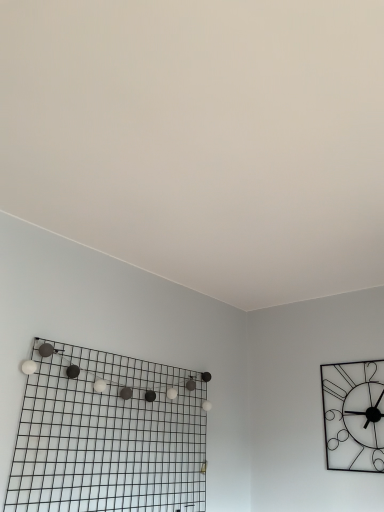
Identify the location of white matte wall clock at upper right. Image resolution: width=384 pixels, height=512 pixels. (354, 415).

This screenshot has width=384, height=512. What do you see at coordinates (354, 415) in the screenshot? I see `white matte wall clock at upper right` at bounding box center [354, 415].

You are a GUI agent. You are given a task and a screenshot of the screen. Output one action in this format:
    pyautogui.click(x=<x>, y=<y>)
    Task: Click on the white matte wall clock at upper right
    
    Given the screenshot: What is the action you would take?
    pyautogui.click(x=354, y=415)